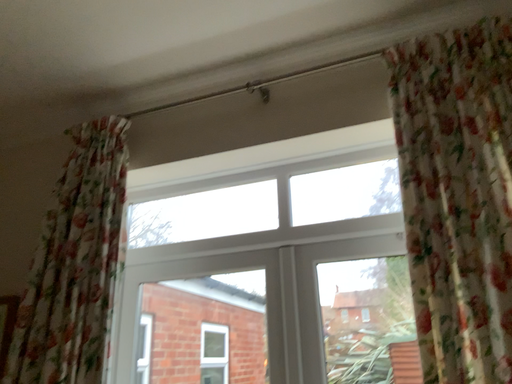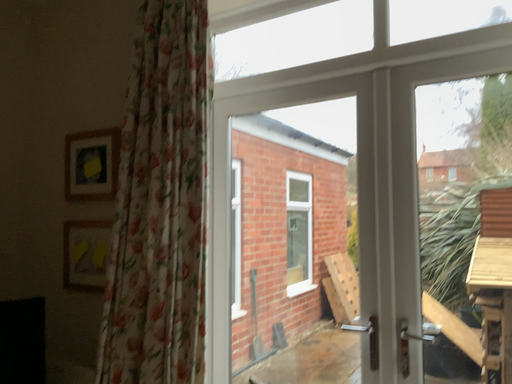
Question: Which way did the camera rotate in the video?

Choices:
 (A) rotated downward
 (B) rotated upward

Answer: (A)